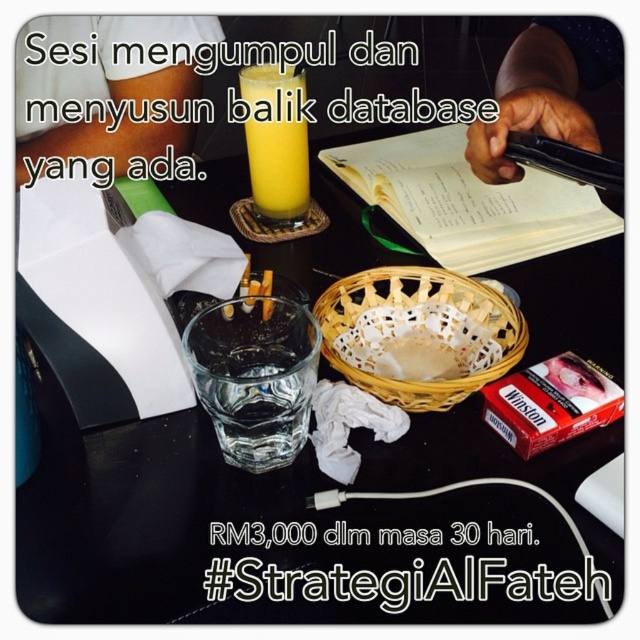
Question: Is transparent glass at center bigger than white paper at center?

Choices:
 (A) no
 (B) yes

Answer: (B)

Question: Based on their relative distances, which object is farther from the woven bamboo basket at center?

Choices:
 (A) black glass at center
 (B) white paper at center
 (C) translucent glass of orange juice at center

Answer: (C)

Question: Can you confirm if black glass at center is bigger than white paper at center?

Choices:
 (A) no
 (B) yes

Answer: (B)

Question: Which of the following is the farthest from the observer?

Choices:
 (A) woven bamboo basket at center
 (B) translucent glass of orange juice at center
 (C) transparent glass at center
 (D) white paper at center

Answer: (B)

Question: Does black glass at center appear on the right side of white paper at center?

Choices:
 (A) no
 (B) yes

Answer: (A)

Question: Which of these objects is positioned farthest from the woven bamboo basket at center?

Choices:
 (A) white paper at center
 (B) transparent glass at center

Answer: (A)